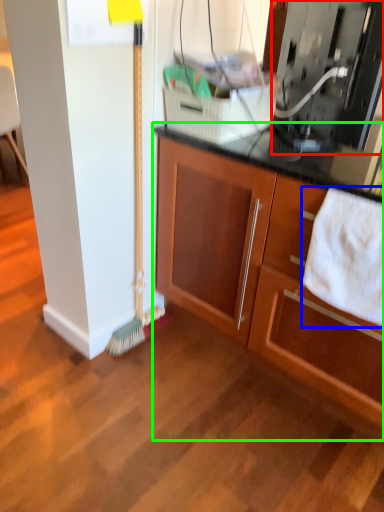
Question: Which is nearer to the appliance (highlighted by a red box)? bath towel (highlighted by a blue box) or cabinetry (highlighted by a green box).

Choices:
 (A) bath towel
 (B) cabinetry

Answer: (A)